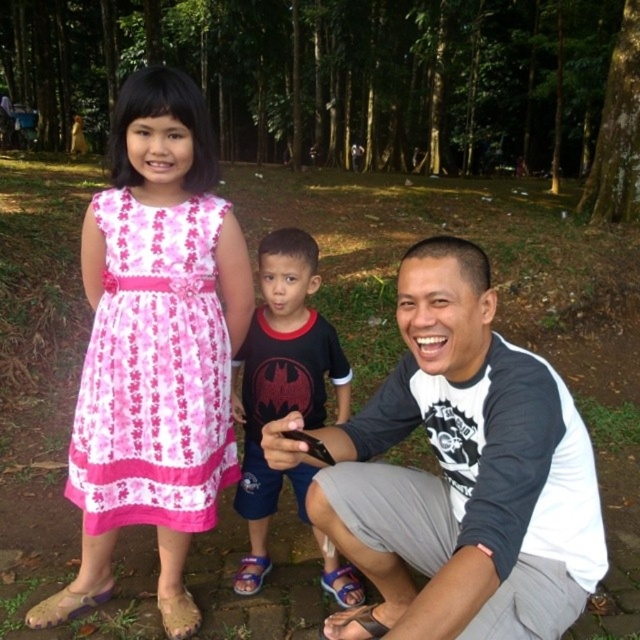
Is pink fabric dress at left wider than dark blue fabric shirt at center?

Yes, pink fabric dress at left is wider than dark blue fabric shirt at center.

Which is below, pink fabric dress at left or dark blue fabric shirt at center?

dark blue fabric shirt at center

At what (x,y) coordinates should I click in order to perform the action: click on pink fabric dress at left. Please return your answer as a coordinate pair (x, y). Looking at the image, I should click on click(154, 372).

Locate an element on the screen. pink fabric dress at left is located at coordinates (154, 372).

In the scene shown: Is pink floral dress at left closer to the viewer compared to dark blue fabric shirt at center?

Yes, it is in front of dark blue fabric shirt at center.

In the scene shown: Is pink floral dress at left to the left of dark blue fabric shirt at center from the viewer's perspective?

Yes, pink floral dress at left is to the left of dark blue fabric shirt at center.

The height and width of the screenshot is (640, 640). What do you see at coordinates (154, 346) in the screenshot? I see `pink floral dress at left` at bounding box center [154, 346].

Locate an element on the screen. pink floral dress at left is located at coordinates (154, 346).

Is gray/white raglan shirt at lower center to the right of pink fabric dress at left from the viewer's perspective?

Indeed, gray/white raglan shirt at lower center is positioned on the right side of pink fabric dress at left.

Is point (536, 538) closer to viewer compared to point (195, 241)?

Yes, point (536, 538) is in front of point (195, 241).

Is point (436, 252) less distant than point (120, 236)?

Yes, point (436, 252) is in front of point (120, 236).

You are a GUI agent. You are given a task and a screenshot of the screen. Output one action in this format:
    pyautogui.click(x=<x>, y=<y>)
    Task: Click on the gray/white raglan shirt at lower center
    
    Given the screenshot: What is the action you would take?
    pyautogui.click(x=464, y=474)